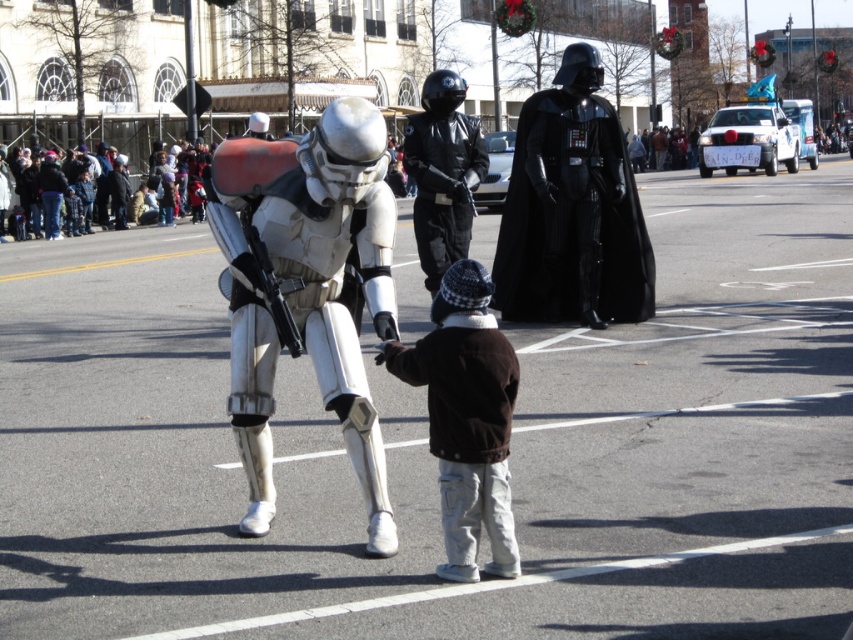
In the scene shown: You are a photographer trying to capture a group photo of the white matte armor at center and the black leather jacket at center. If you want to ensure both subjects are fully visible in the frame, which subject should you position closer to the camera to avoid cropping?

The white matte armor at center has a larger width than the black leather jacket at center, so positioning the white matte armor at center closer to the camera will help ensure its full visibility without cropping.